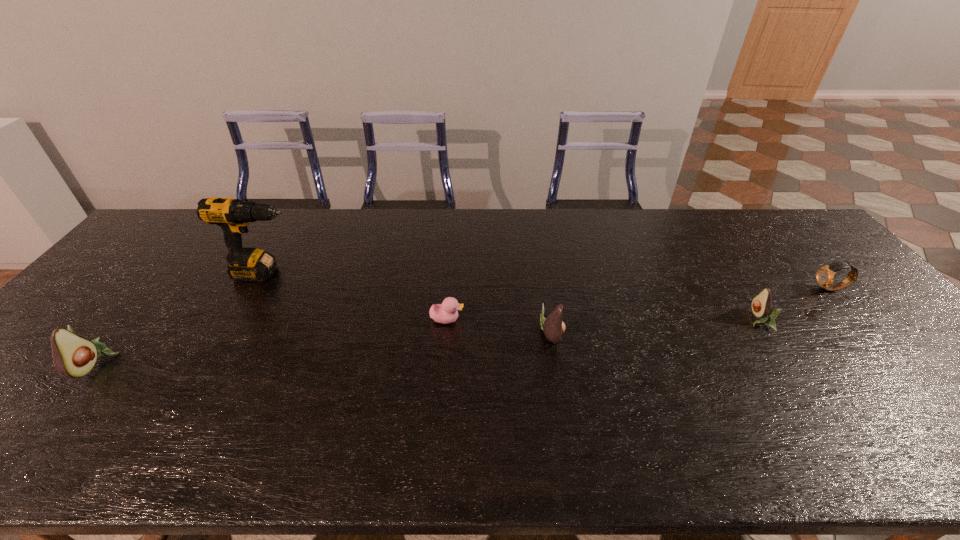
Find the location of a particular element. the tallest avocado is located at coordinates (73, 356).

Identify the location of the leftmost avocado. The width and height of the screenshot is (960, 540). (73, 356).

Where is `the second tallest avocado`? Image resolution: width=960 pixels, height=540 pixels. the second tallest avocado is located at coordinates (553, 327).

Where is `the fourth object from left to right`? the fourth object from left to right is located at coordinates (553, 327).

What are the coordinates of `the shortest avocado` in the screenshot? It's located at (761, 305).

Where is `the second object from right to left`? the second object from right to left is located at coordinates (761, 305).

The image size is (960, 540). I want to click on duckling, so click(445, 313).

The height and width of the screenshot is (540, 960). Identify the location of the fourth object from right to left. (445, 313).

Find the location of a particular element. the fifth object from right to left is located at coordinates (233, 215).

Where is `drill`? drill is located at coordinates (233, 215).